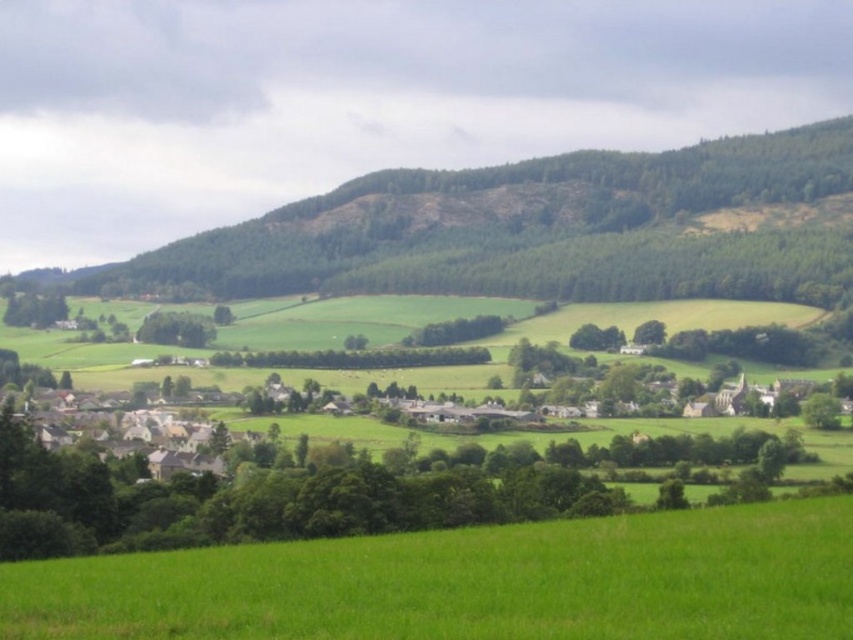
Can you confirm if green grassy field at lower center is positioned above green forested hill at upper center?

No.

Is point (173, 554) farther from viewer compared to point (833, 125)?

No, (173, 554) is closer to viewer.

Find the location of `green grassy field at lower center`. green grassy field at lower center is located at coordinates (469, 582).

Can you confirm if green grassy field at lower center is positioned below green leafy tree at center?

Yes, green grassy field at lower center is below green leafy tree at center.

Between green grassy field at lower center and green leafy tree at center, which one appears on the right side from the viewer's perspective?

From the viewer's perspective, green grassy field at lower center appears more on the right side.

Between point (666, 632) and point (143, 324), which one is positioned behind?

Point (143, 324)

This screenshot has height=640, width=853. I want to click on green grassy field at lower center, so click(469, 582).

Does green grassy field at lower center appear on the right side of green leafy tree at lower left?

Indeed, green grassy field at lower center is positioned on the right side of green leafy tree at lower left.

Who is positioned more to the left, green grassy field at lower center or green leafy tree at lower left?

Positioned to the left is green leafy tree at lower left.

Does point (396, 620) lie in front of point (12, 312)?

Yes.

Where is `green grassy field at lower center`? The image size is (853, 640). green grassy field at lower center is located at coordinates point(469,582).